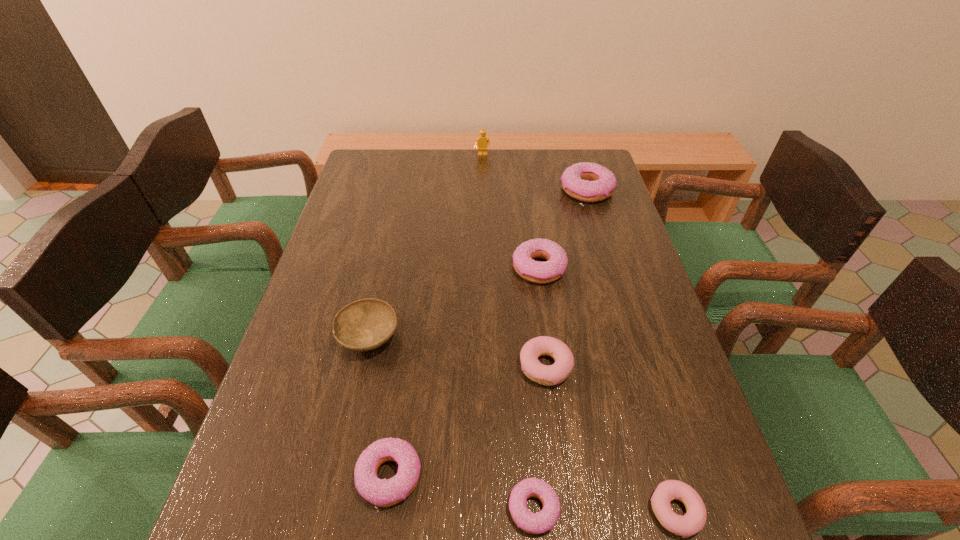
This screenshot has height=540, width=960. Identify the location of unoccupied position between the third object from left to right and the fifth nearest doughnut. click(x=511, y=211).

I want to click on blank region between the farthest doughnut and the smaller pink doughnut, so click(632, 350).

At what (x,y) coordinates should I click in order to perform the action: click on free spot between the third biggest purple doughnut and the smallest purple doughnut. Please return your answer as a coordinate pair (x, y). Image resolution: width=960 pixels, height=540 pixels. Looking at the image, I should click on (462, 492).

Select which object is the fifth closest to the gray bowl. Please provide its 2D coordinates. Your answer should be formatted as a tuple, i.e. [(x, y)], where the tuple contains the x and y coordinates of a point satisfying the conditions above.

[(693, 521)]

Where is `object that is the third closest one to the nearer pink doughnut`? object that is the third closest one to the nearer pink doughnut is located at coordinates (383, 493).

The height and width of the screenshot is (540, 960). I want to click on the fifth closest doughnut to the farthest doughnut, so click(383, 493).

Choose which doughnut is the sixth nearest neighbor to the farthest object. Please provide its 2D coordinates. Your answer should be formatted as a tuple, i.e. [(x, y)], where the tuple contains the x and y coordinates of a point satisfying the conditions above.

[(693, 521)]

Identify which purple doughnut is the second closest to the second tallest doughnut. Please provide its 2D coordinates. Your answer should be formatted as a tuple, i.e. [(x, y)], where the tuple contains the x and y coordinates of a point satisfying the conditions above.

[(383, 493)]

Image resolution: width=960 pixels, height=540 pixels. What are the coordinates of `purple doughnut that stands as the second closest to the leftmost doughnut` in the screenshot? It's located at (534, 271).

The height and width of the screenshot is (540, 960). I want to click on free space that satisfies the following two spatial constraints: 1. on the face of the smallest purple doughnut; 2. on the right side of the farthest object, so click(486, 509).